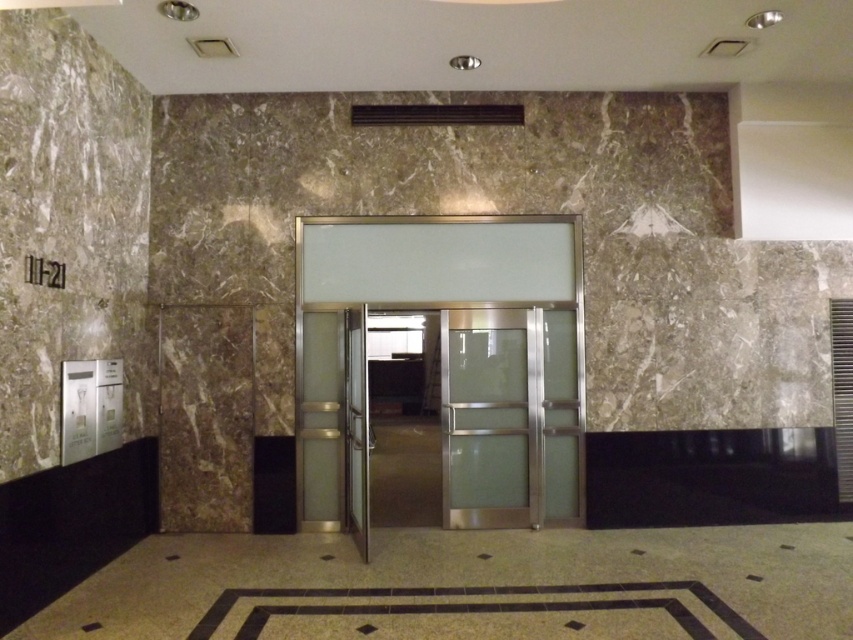
From the picture: You are a delivery person carrying a large package that is 2 meters wide. You are in the lobby and need to enter either the satin glass elevator doors at center or the clear glass door at center. Based on their widths, which one can you use to pass through with your package?

The satin glass elevator doors at center are wider than the clear glass door at center, so you should use the satin glass elevator doors at center to pass through with your 2 meter wide package.

You are standing in the lobby and want to exit through the hallway. The satin glass elevator doors at center and the clear glass door at center are both in front of you. Which one should you approach to enter the hallway?

The satin glass elevator doors at center is to the left of clear glass door at center, so you should approach the satin glass elevator doors at center to enter the hallway since it is the one leading to the hallway.